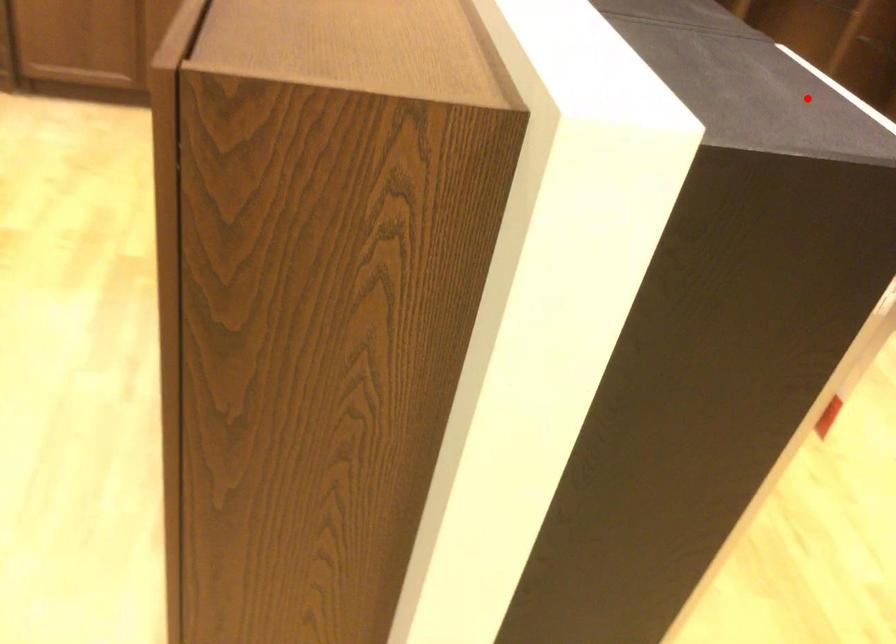
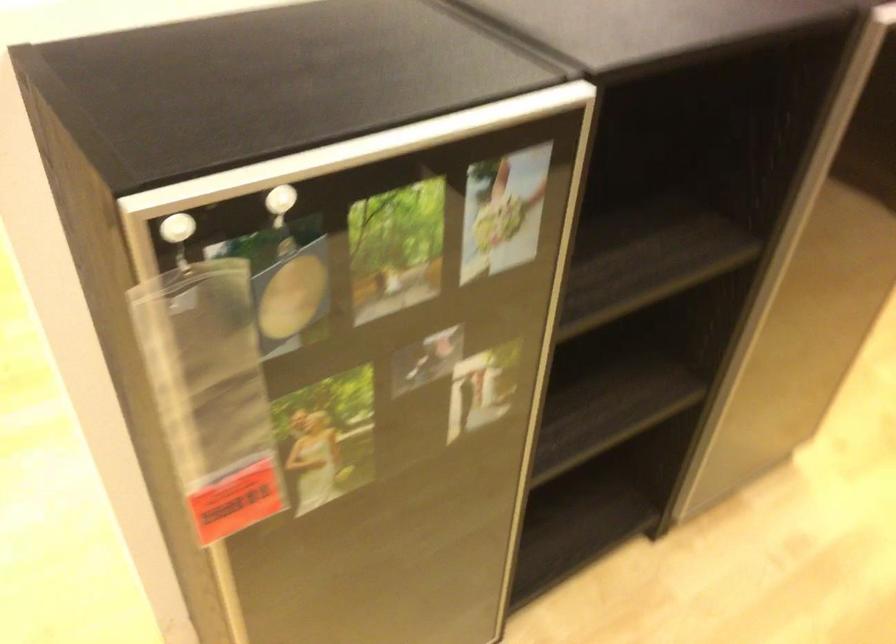
In the second image, find the point that corresponds to the highlighted location in the first image.

(356, 152)